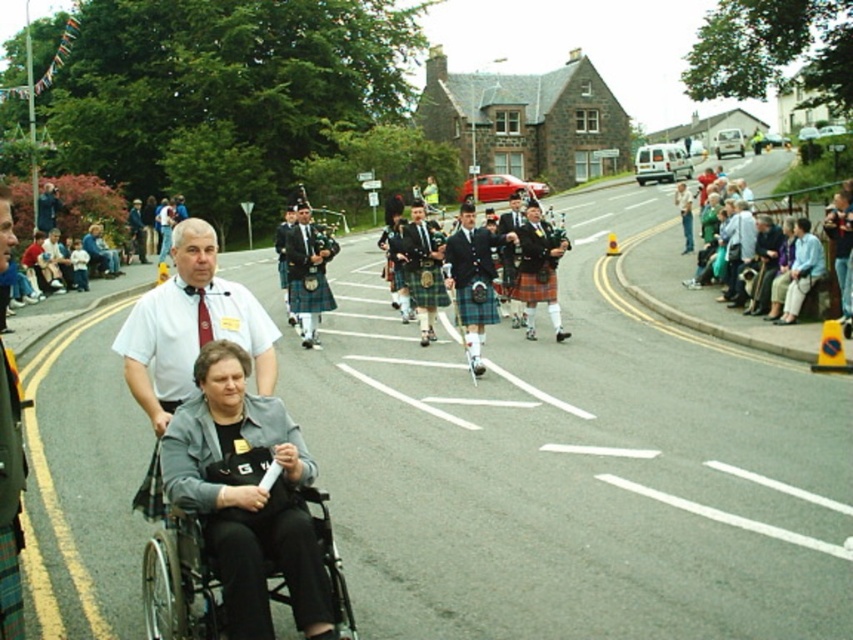
You are a photographer at the parade. You want to take a photo that includes both the black plastic wheelchair at lower left and the green plaid kilt at center. Which object should be placed to the right side in your photo?

The black plastic wheelchair at lower left is positioned on the right side of green plaid kilt at center, so in your photo, the black plastic wheelchair at lower left should be placed to the right side.

You are a photographer standing in the middle of the street during the parade. You want to take a photo of both the white shirt at center and the black plastic wheelchair at lower left. Which object should you focus on first to ensure both are in the frame?

You should focus on the white shirt at center first because it is closer to you than the black plastic wheelchair at lower left, so adjusting the frame to include the closer object first will help ensure both are visible.